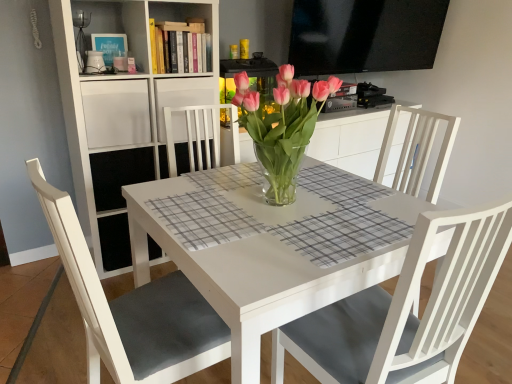
Question: From a real-world perspective, is white matte shelf at upper left, the 2th shelf from the top, physically located above or below pink glass vase at center?

Choices:
 (A) above
 (B) below

Answer: (B)

Question: Is white matte shelf at upper left, the 2th shelf from the top, in front of or behind pink glass vase at center in the image?

Choices:
 (A) front
 (B) behind

Answer: (B)

Question: Which is nearer to the white matte chair at lower left?

Choices:
 (A) pink glass vase at center
 (B) white wood shelf at upper center, placed as the 1th shelf when sorted from top to bottom
 (C) white matte bookshelf at upper left, which is counted as the 3th shelf, starting from the top
 (D) white glossy table at center
 (E) white matte shelf at upper left, which appears as the 2th shelf when ordered from the bottom

Answer: (D)

Question: Based on their relative distances, which object is nearer to the white matte shelf at upper left, the 2th shelf from the top?

Choices:
 (A) white wood shelf at upper center, the 3th shelf positioned from the bottom
 (B) white matte chair at lower left
 (C) pink glass vase at center
 (D) white glossy table at center
 (E) white matte bookshelf at upper left, which is counted as the 3th shelf, starting from the top

Answer: (E)